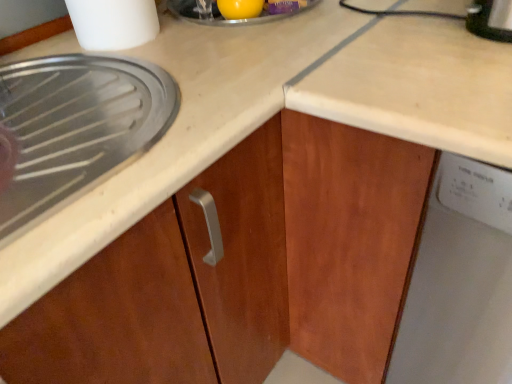
Locate an element on the screen. The image size is (512, 384). vacant region above matte wood cabinet at left (from a real-world perspective) is located at coordinates (70, 104).